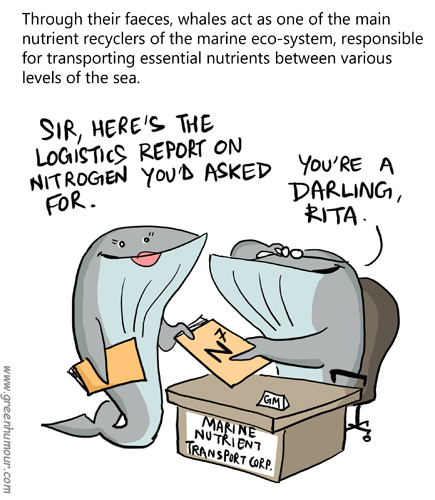
What are the coordinates of `chair wheel` in the screenshot? It's located at (366, 439).